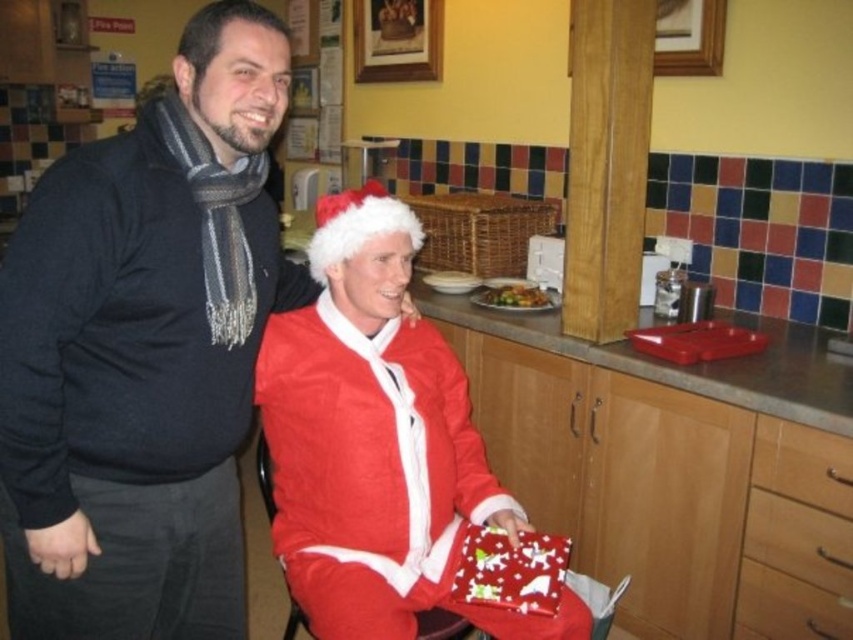
You are trying to locate the matte red santa suit at center in the image. According to the coordinates provided, where exactly is it positioned?

The matte red santa suit at center is located at point coordinates of (144,352).

You are trying to find the shiny red wrapping paper at lower center in the image. Which direction should you look relative to the fuzzy red santa suit at center?

The shiny red wrapping paper at lower center is to the right of the fuzzy red santa suit at center.

Consider the image. You are organizing a holiday party and need to place a 1.2 meter wide banner between the matte red santa suit at center and the shiny red wrapping paper at lower center. Can the space accommodate the banner?

The matte red santa suit at center is wider than the shiny red wrapping paper at lower center. However, the exact distance between them isn not specified in the provided information. Without knowing the distance between the two objects, it is impossible to determine if the 1.2 meter banner will fit.